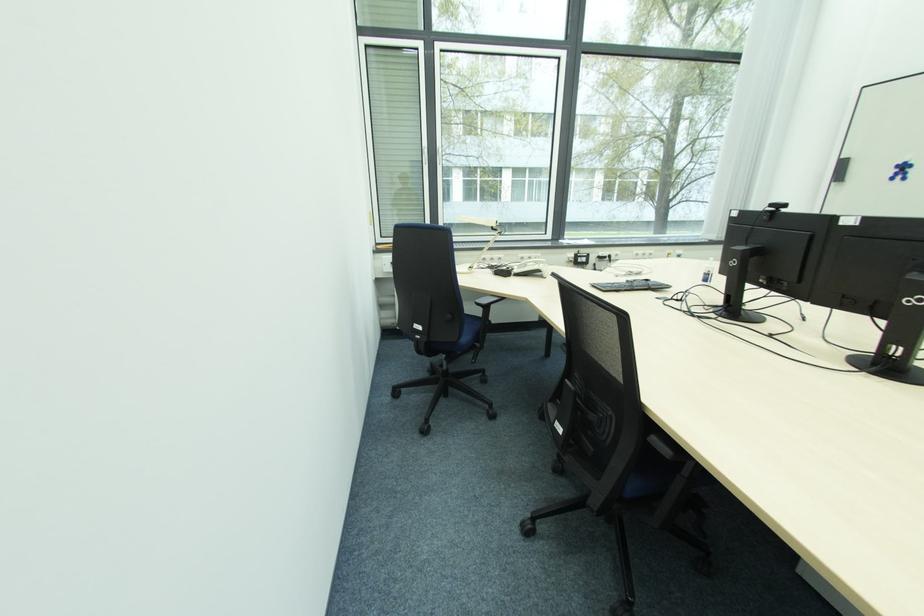
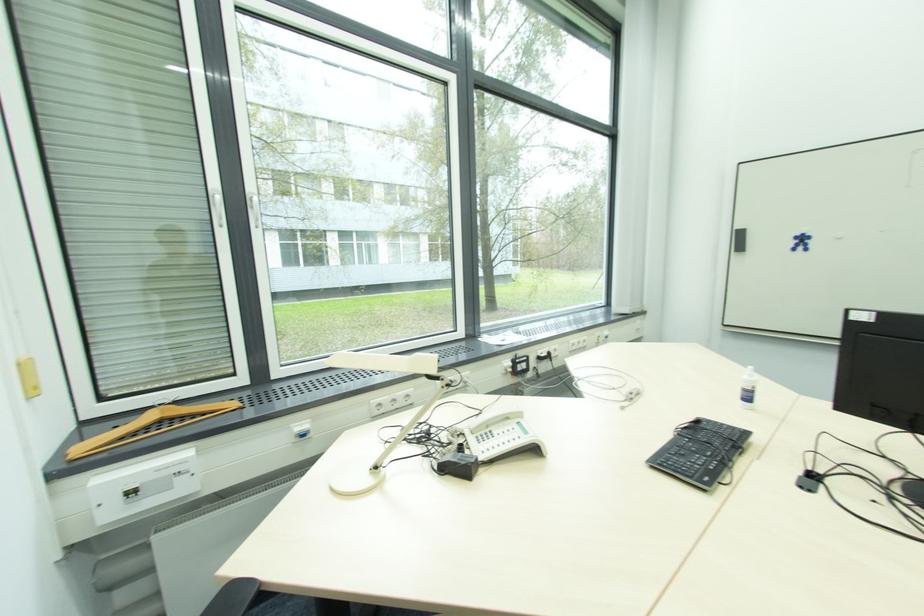
The point at (650, 283) is marked in the first image. Where is the corresponding point in the second image?

(700, 424)